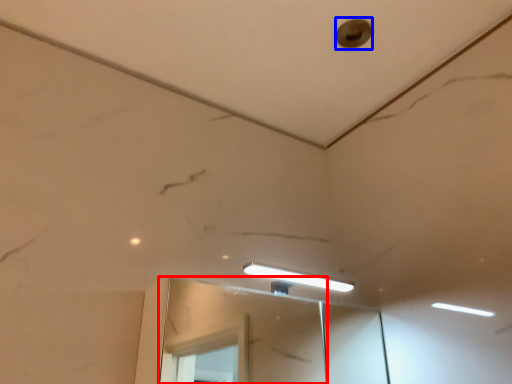
Question: Which of the following is the closest to the observer, mirror (highlighted by a red box) or hole (highlighted by a blue box)?

Choices:
 (A) mirror
 (B) hole

Answer: (A)